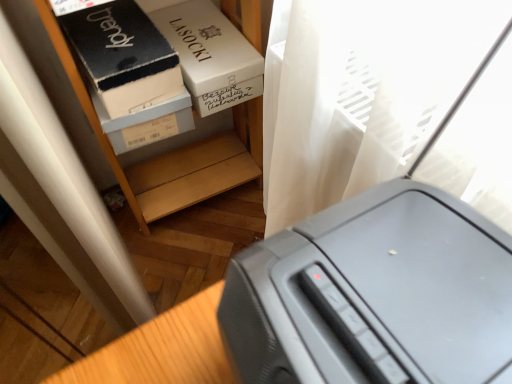
What is the approximate height of gray plastic printer at lower right?

The height of gray plastic printer at lower right is 4.80 inches.

What do you see at coordinates (375, 292) in the screenshot?
I see `gray plastic printer at lower right` at bounding box center [375, 292].

In order to face gray plastic printer at lower right, should I rotate leftwards or rightwards?

Turn right approximately 13.822 degrees to face it.

This screenshot has width=512, height=384. Identify the location of gray plastic printer at lower right. (375, 292).

Image resolution: width=512 pixels, height=384 pixels. I want to click on gray plastic printer at lower right, so click(x=375, y=292).